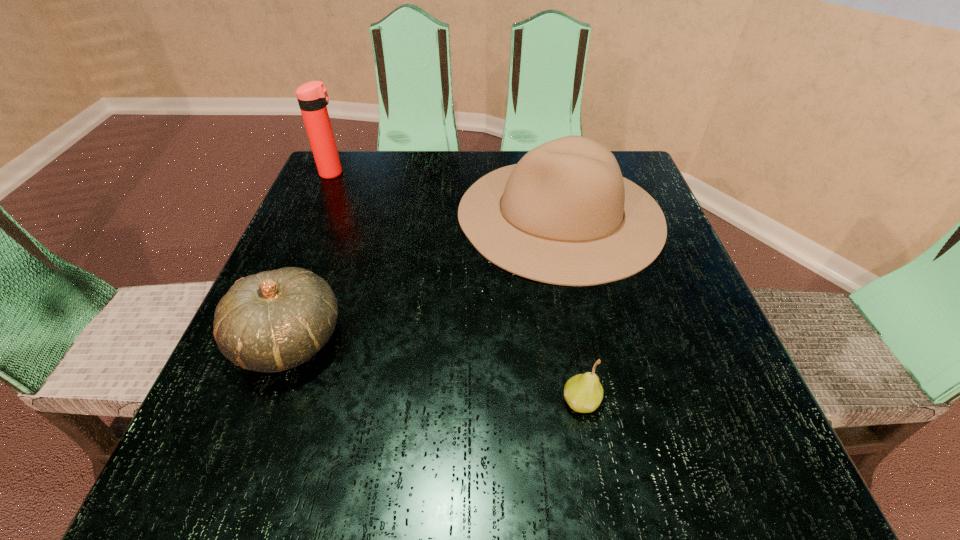
In order to click on vacant space at the near left corner of the desktop in this screenshot , I will do `click(255, 448)`.

In order to click on blank space at the far right corner in this screenshot , I will do `click(646, 189)`.

Locate an element on the screen. The width and height of the screenshot is (960, 540). vacant area at the near right corner is located at coordinates (743, 479).

Locate an element on the screen. Image resolution: width=960 pixels, height=540 pixels. vacant space that's between the gourd and the sombrero is located at coordinates (425, 278).

Locate an element on the screen. The height and width of the screenshot is (540, 960). vacant space that is in between the tallest object and the second tallest object is located at coordinates (446, 194).

At what (x,y) coordinates should I click in order to perform the action: click on vacant area between the shortest object and the third tallest object. Please return your answer as a coordinate pair (x, y). The image size is (960, 540). Looking at the image, I should click on (436, 371).

Image resolution: width=960 pixels, height=540 pixels. I want to click on free space between the tallest object and the third shortest object, so click(446, 194).

Locate an element on the screen. This screenshot has height=540, width=960. vacant region between the second tallest object and the tallest object is located at coordinates (446, 194).

Locate an element on the screen. This screenshot has width=960, height=540. free space that is in between the thermos bottle and the sombrero is located at coordinates (446, 194).

Identify the location of empty space between the pear and the tallest object. (457, 287).